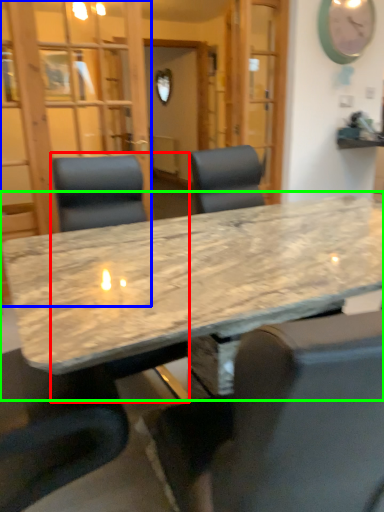
Question: Which object is the closest to the chair (highlighted by a red box)? Choose among these: glass door (highlighted by a blue box) or table (highlighted by a green box).

Choices:
 (A) glass door
 (B) table

Answer: (B)